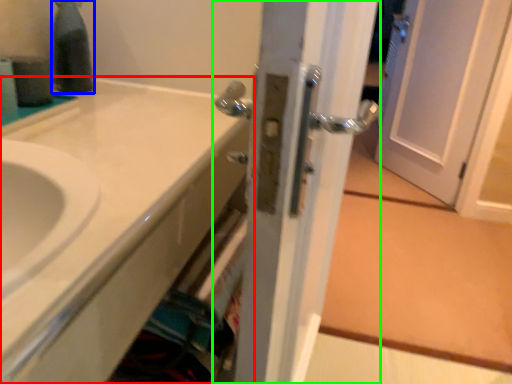
Question: Which object is the closest to the bathroom cabinet (highlighted by a red box)? Choose among these: bottle (highlighted by a blue box) or door (highlighted by a green box).

Choices:
 (A) bottle
 (B) door

Answer: (B)